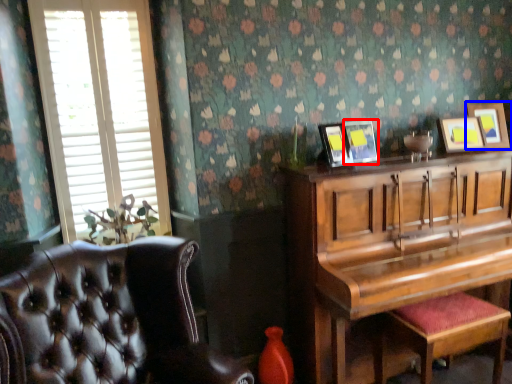
Question: Among these objects, which one is farthest to the camera, picture frame (highlighted by a red box) or picture frame (highlighted by a blue box)?

Choices:
 (A) picture frame
 (B) picture frame

Answer: (B)